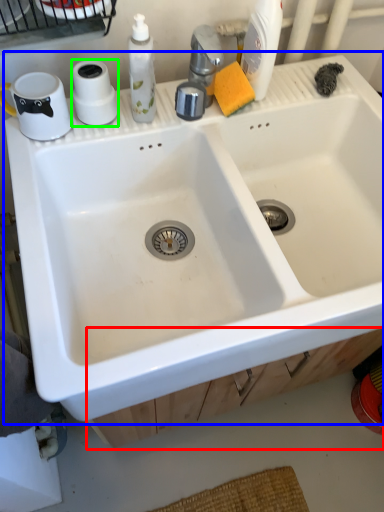
Question: Estimate the real-world distances between objects in this image. Which object is closer to drawer (highlighted by a red box), sink (highlighted by a blue box) or toilet paper (highlighted by a green box)?

Choices:
 (A) sink
 (B) toilet paper

Answer: (A)